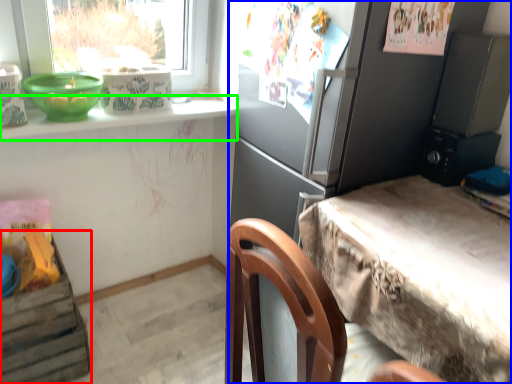
Question: Which object is the farthest from shelf (highlighted by a red box)? Choose among these: cabinetry (highlighted by a blue box) or window sill (highlighted by a green box).

Choices:
 (A) cabinetry
 (B) window sill

Answer: (A)